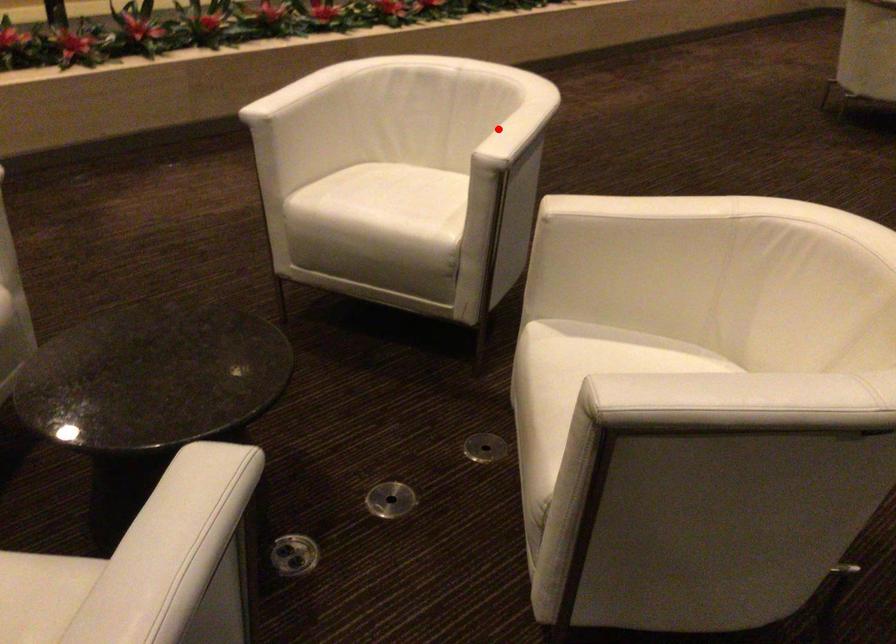
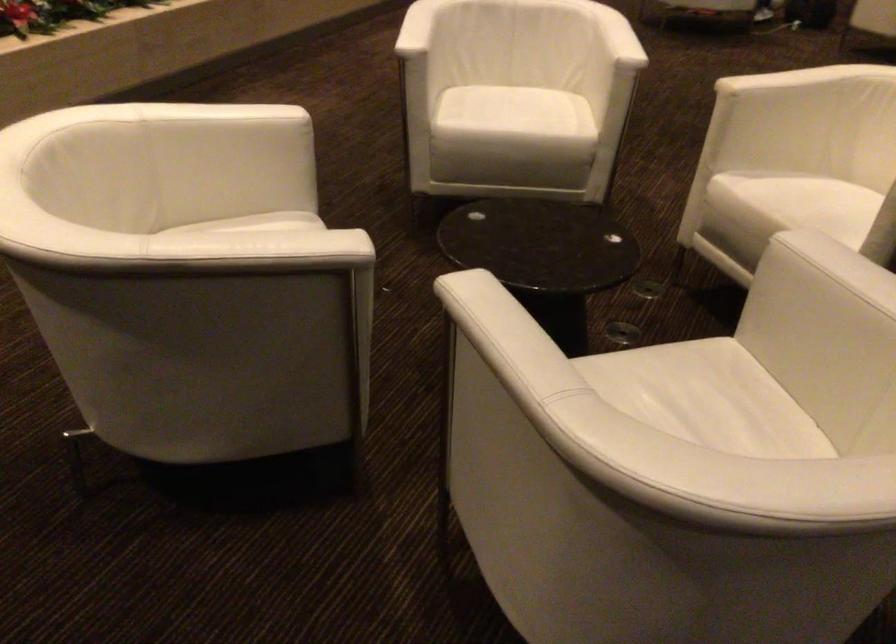
Where in the second image is the point corresponding to the highlighted location from the first image?

(617, 37)